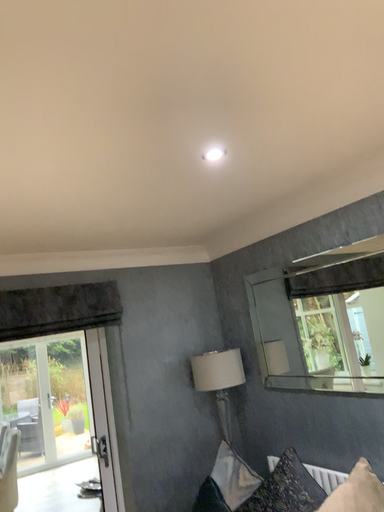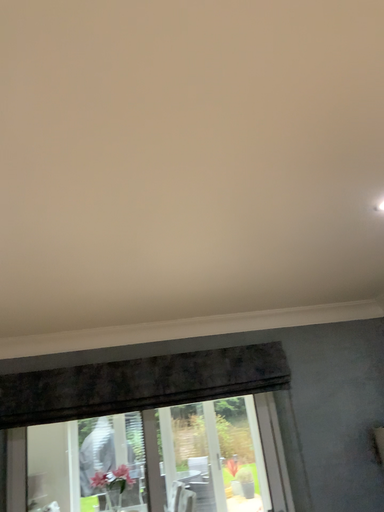
Question: How did the camera likely rotate when shooting the video?

Choices:
 (A) rotated downward
 (B) rotated upward

Answer: (B)